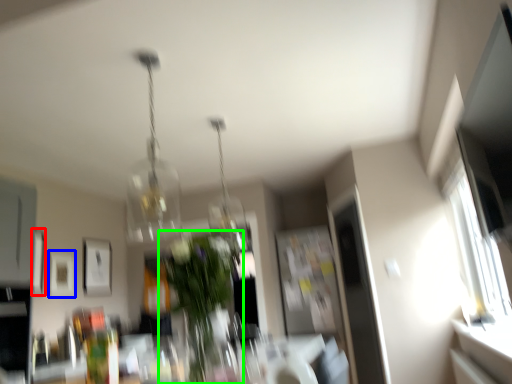
Question: Estimate the real-world distances between objects in this image. Which object is closer to picture frame (highlighted by a red box), picture frame (highlighted by a blue box) or houseplant (highlighted by a green box)?

Choices:
 (A) picture frame
 (B) houseplant

Answer: (A)